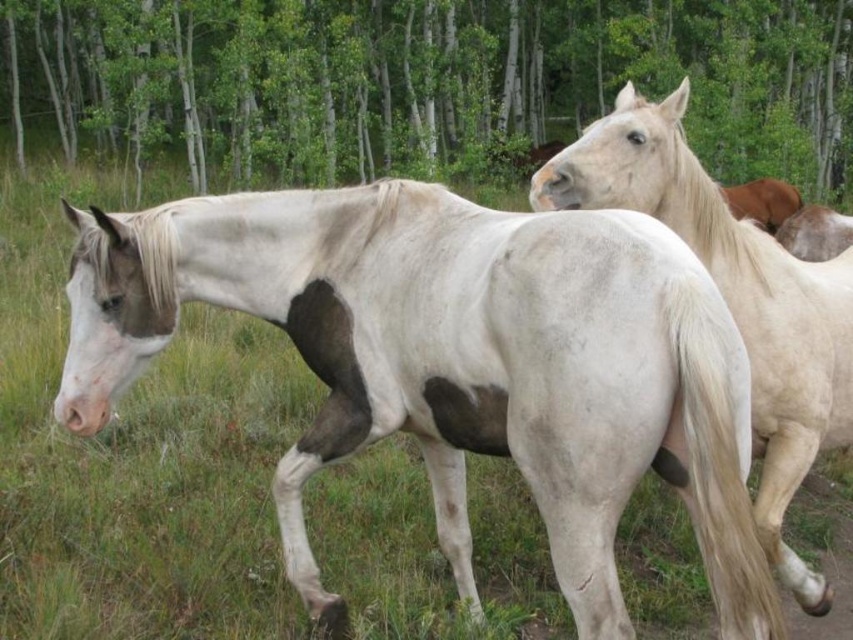
You are a photographer setting up a camera to capture both the white matte horse at center and the white matte horse at upper right. The camera has a fixed width of 10 meters. Can you fit both horses in the frame without moving the camera?

The white matte horse at center might be wider than the white matte horse at upper right, so it depends on their combined width. If their total width is within 10 meters, they can fit. However, since the exact width isn

You are a photographer positioned at the camera. You want to capture a closeup shot of the white matte horse at center. Given that your camera has a minimum focusing distance of 5 feet, will you be able to achieve this without moving closer?

The distance between the white matte horse at center and the camera is 6.31 feet, which is greater than the minimum focusing distance of 5 feet. Therefore, you can capture the closeup shot without moving closer.